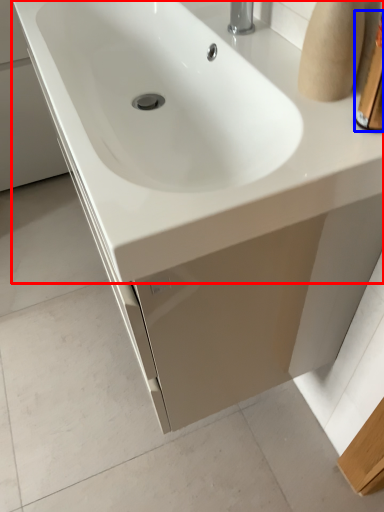
Question: Which object is closer to the camera taking this photo, sink (highlighted by a red box) or toiletry (highlighted by a blue box)?

Choices:
 (A) sink
 (B) toiletry

Answer: (B)